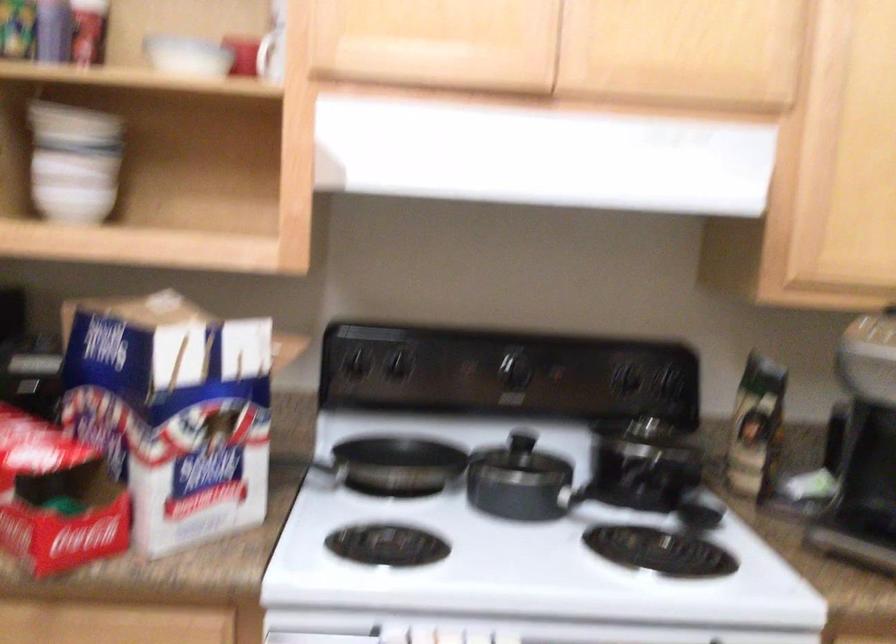
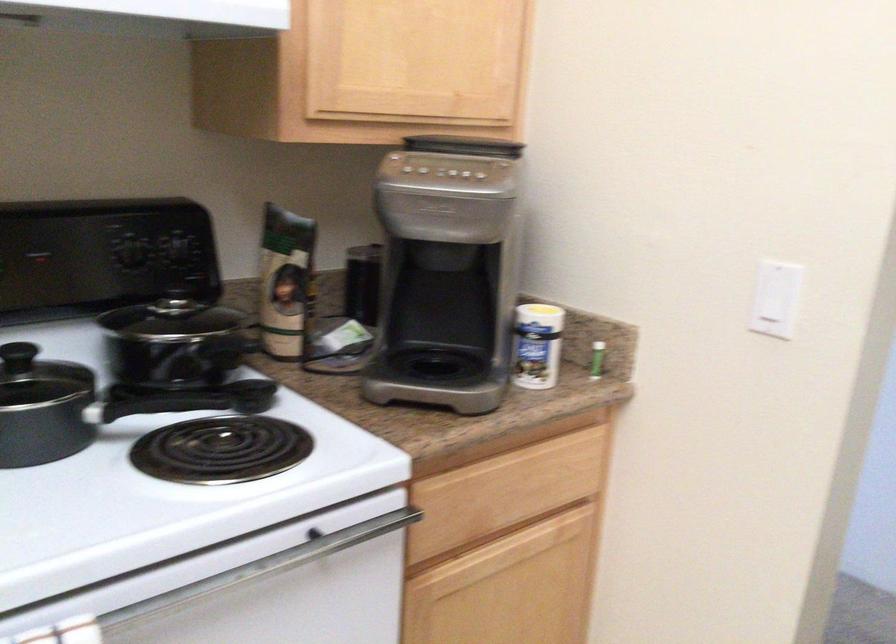
Locate, in the second image, the point that corresponds to pixel 751 422 in the first image.

(286, 281)